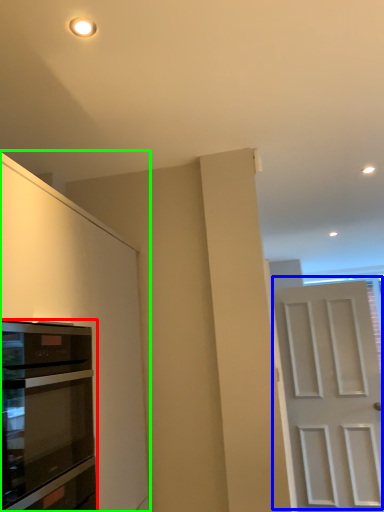
Question: Which is farther away from oven (highlighted by a red box)? door (highlighted by a blue box) or cabinetry (highlighted by a green box)?

Choices:
 (A) door
 (B) cabinetry

Answer: (A)